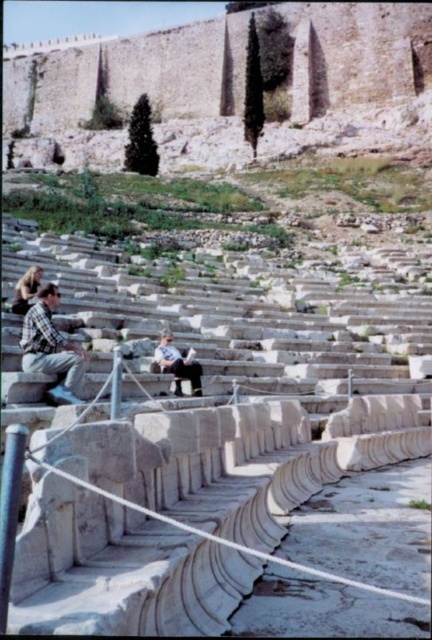
Question: Does light brown leather jacket at center have a smaller size compared to light brown hair at left?

Choices:
 (A) yes
 (B) no

Answer: (A)

Question: Does plaid shirt at center have a greater width compared to light brown hair at left?

Choices:
 (A) no
 (B) yes

Answer: (B)

Question: Does light brown leather jacket at center appear over light brown hair at left?

Choices:
 (A) yes
 (B) no

Answer: (B)

Question: Which point is closer to the camera?

Choices:
 (A) light brown leather jacket at center
 (B) light brown hair at left

Answer: (A)

Question: Which of the following is the farthest from the observer?

Choices:
 (A) plaid shirt at center
 (B) light brown hair at left

Answer: (B)

Question: Considering the real-world distances, which object is farthest from the light brown hair at left?

Choices:
 (A) light brown leather jacket at center
 (B) plaid shirt at center

Answer: (A)